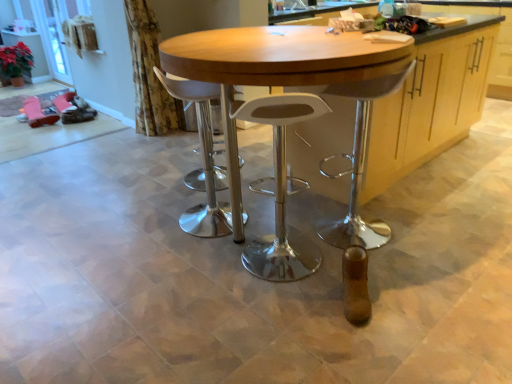
Image resolution: width=512 pixels, height=384 pixels. In order to click on free point behind white plastic stool at center, the 1th stool from the right in this screenshot , I will do `click(272, 224)`.